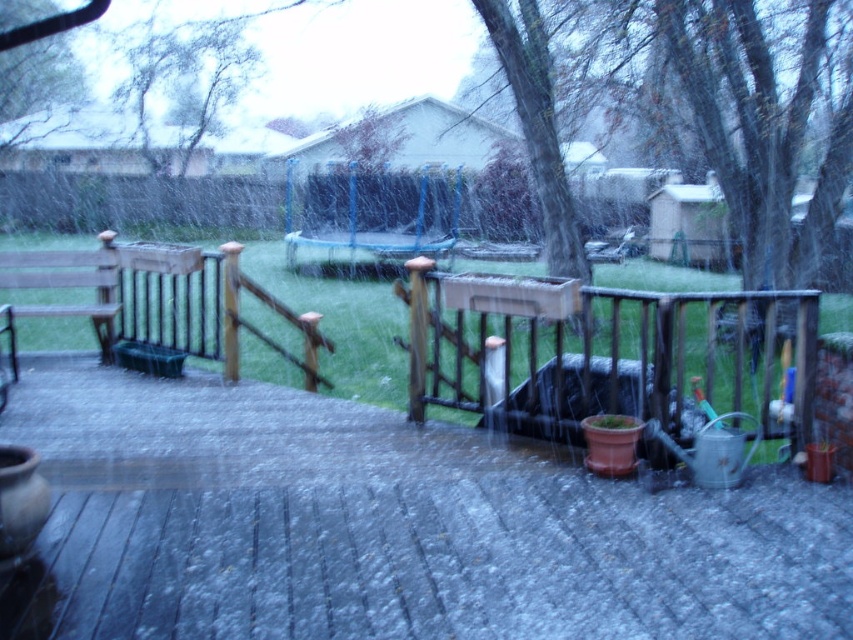
You are standing on the wooden bench at left and want to step down onto the smooth wooden deck at center. Is the deck below the bench?

Yes, the smooth wooden deck at center is located below the wooden bench at left, so you can step down onto it safely.

You are looking through the window at the backyard scene. There are two points marked in the image. The first point is at coordinate point (401, 531) and the second is at point (807, 372). Which of these two points is closer to you?

Point (401, 531) is closer to the camera than point (807, 372).

You are standing inside a house looking out through the window described in the scene. You see the smooth wooden deck at center and the wooden at right. Which of these two wooden structures is closer to you?

The smooth wooden deck at center is closer to you because it is in front of the wooden at right.